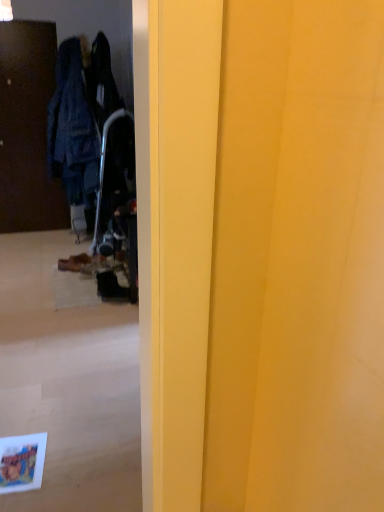
Question: From the image's perspective, does dark wood door at left appear higher than brown suede shoe at lower left?

Choices:
 (A) no
 (B) yes

Answer: (B)

Question: Is dark wood door at left touching brown suede shoe at lower left?

Choices:
 (A) no
 (B) yes

Answer: (A)

Question: Would you say dark wood door at left is a long distance from brown suede shoe at lower left?

Choices:
 (A) no
 (B) yes

Answer: (B)

Question: Does dark wood door at left appear on the right side of brown suede shoe at lower left?

Choices:
 (A) yes
 (B) no

Answer: (B)

Question: From a real-world perspective, is dark wood door at left on brown suede shoe at lower left?

Choices:
 (A) yes
 (B) no

Answer: (A)

Question: From the image's perspective, is dark wood door at left beneath brown suede shoe at lower left?

Choices:
 (A) yes
 (B) no

Answer: (B)

Question: Does brown suede shoe at lower left have a greater height compared to dark wood door at left?

Choices:
 (A) yes
 (B) no

Answer: (B)

Question: From a real-world perspective, is brown suede shoe at lower left on top of dark wood door at left?

Choices:
 (A) no
 (B) yes

Answer: (A)

Question: Is brown suede shoe at lower left next to dark wood door at left and touching it?

Choices:
 (A) no
 (B) yes

Answer: (A)

Question: Considering the relative sizes of brown suede shoe at lower left and dark wood door at left in the image provided, is brown suede shoe at lower left smaller than dark wood door at left?

Choices:
 (A) yes
 (B) no

Answer: (A)

Question: From the image's perspective, would you say brown suede shoe at lower left is shown under dark wood door at left?

Choices:
 (A) yes
 (B) no

Answer: (A)

Question: Considering the relative sizes of brown suede shoe at lower left and dark wood door at left in the image provided, is brown suede shoe at lower left wider than dark wood door at left?

Choices:
 (A) yes
 (B) no

Answer: (A)

Question: Looking at their shapes, would you say dark wood door at left is wider or thinner than brown suede shoe at lower left?

Choices:
 (A) thin
 (B) wide

Answer: (A)